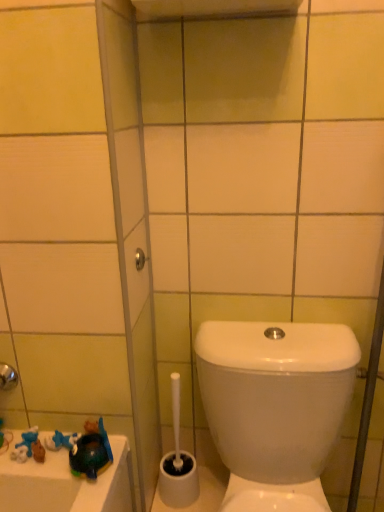
Question: From the image's perspective, is matte silver showerhead at upper center located above white glossy toilet at lower right?

Choices:
 (A) yes
 (B) no

Answer: (A)

Question: From a real-world perspective, is matte silver showerhead at upper center positioned over white glossy toilet at lower right based on gravity?

Choices:
 (A) yes
 (B) no

Answer: (A)

Question: Is matte silver showerhead at upper center taller than white glossy toilet at lower right?

Choices:
 (A) no
 (B) yes

Answer: (A)

Question: Is matte silver showerhead at upper center positioned behind white glossy toilet at lower right?

Choices:
 (A) no
 (B) yes

Answer: (B)

Question: Is matte silver showerhead at upper center positioned far away from white glossy toilet at lower right?

Choices:
 (A) yes
 (B) no

Answer: (B)

Question: Does matte silver showerhead at upper center contain white glossy toilet at lower right?

Choices:
 (A) yes
 (B) no

Answer: (B)

Question: Does shiny blue plastic toy at lower left appear on the right side of white plastic toilet brush at lower center?

Choices:
 (A) yes
 (B) no

Answer: (B)

Question: Can you confirm if shiny blue plastic toy at lower left is shorter than white plastic toilet brush at lower center?

Choices:
 (A) yes
 (B) no

Answer: (A)

Question: Does shiny blue plastic toy at lower left have a greater width compared to white plastic toilet brush at lower center?

Choices:
 (A) yes
 (B) no

Answer: (B)

Question: Is shiny blue plastic toy at lower left not near white plastic toilet brush at lower center?

Choices:
 (A) no
 (B) yes

Answer: (A)

Question: From the image's perspective, is shiny blue plastic toy at lower left on white plastic toilet brush at lower center?

Choices:
 (A) yes
 (B) no

Answer: (A)

Question: Is shiny blue plastic toy at lower left positioned before white plastic toilet brush at lower center?

Choices:
 (A) no
 (B) yes

Answer: (B)

Question: From a real-world perspective, is shiny blue plastic toy at lower left located higher than white glossy toilet at lower right?

Choices:
 (A) yes
 (B) no

Answer: (A)